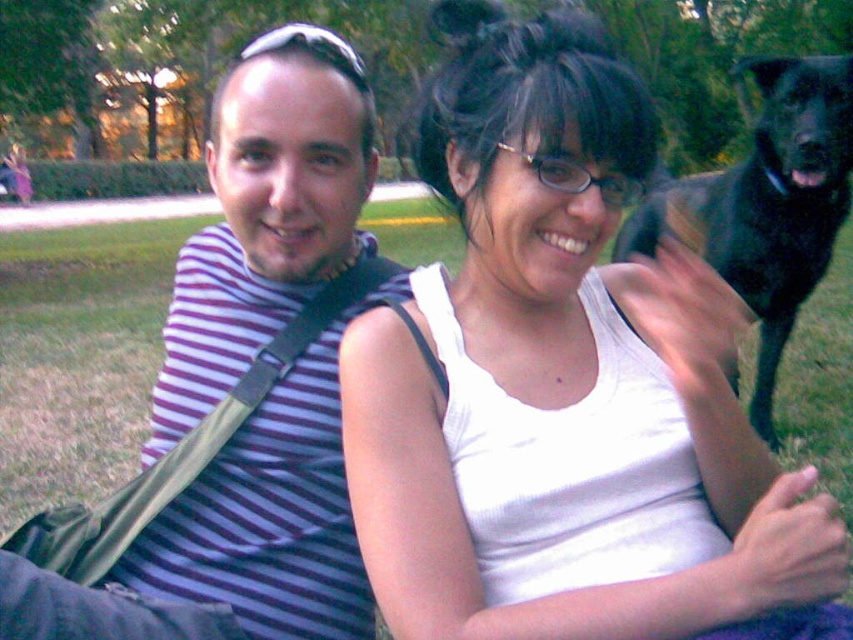
Is purple striped shirt at left to the left of black furry dog at upper right from the viewer's perspective?

Indeed, purple striped shirt at left is positioned on the left side of black furry dog at upper right.

Does purple striped shirt at left have a greater height compared to black furry dog at upper right?

Correct, purple striped shirt at left is much taller as black furry dog at upper right.

Describe the element at coordinates (265, 216) in the screenshot. The image size is (853, 640). I see `purple striped shirt at left` at that location.

The height and width of the screenshot is (640, 853). What are the coordinates of `purple striped shirt at left` in the screenshot? It's located at (265, 216).

Who is more forward, (799, 67) or (416, 376)?

Point (416, 376) is in front.

Between black furry dog at upper right and green grass at lower left, which one has more height?

green grass at lower left

Where is `black furry dog at upper right`? black furry dog at upper right is located at coordinates (769, 204).

Between point (619, 100) and point (438, 490), which one is positioned behind?

The point (438, 490) is more distant.

The image size is (853, 640). I want to click on white tank top at center, so click(566, 385).